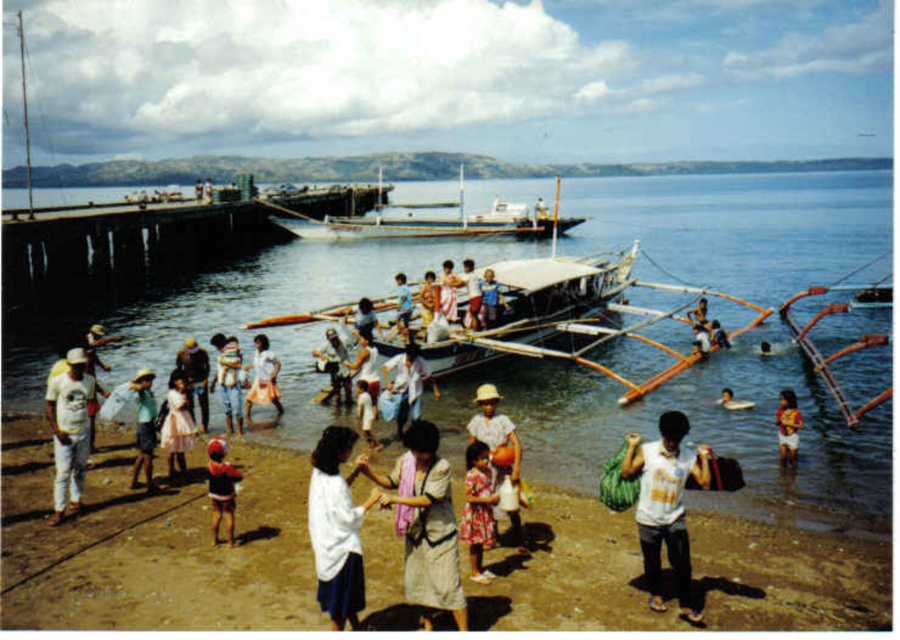
Question: Can you confirm if light beige cotton dress at center is positioned to the right of red cotton shirt at lower center?

Choices:
 (A) no
 (B) yes

Answer: (B)

Question: Is beige sand beach at center below white matte shirt at lower center?

Choices:
 (A) no
 (B) yes

Answer: (B)

Question: Which object is the farthest from the white matte shirt at lower center?

Choices:
 (A) pink satin dress at center
 (B) wooden planks boat at center

Answer: (B)

Question: Based on their relative distances, which object is nearer to the beige sand beach at center?

Choices:
 (A) white matte shirt at lower center
 (B) pink satin dress at center
 (C) white cotton shirt at center
 (D) dusty pink dress at center

Answer: (D)

Question: Can you confirm if wooden boat at center is positioned to the left of red cotton shirt at lower center?

Choices:
 (A) yes
 (B) no

Answer: (B)

Question: Among these points, which one is farthest from the camera?

Choices:
 (A) (88, 582)
 (B) (655, 582)

Answer: (A)